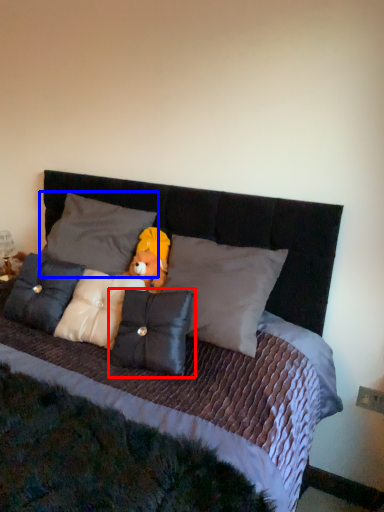
Question: Which object appears farthest to the camera in this image, pillow (highlighted by a red box) or pillow (highlighted by a blue box)?

Choices:
 (A) pillow
 (B) pillow

Answer: (B)